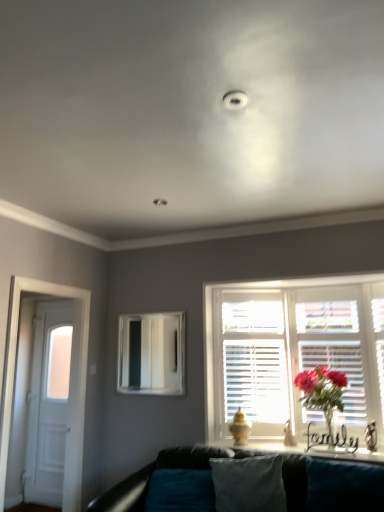
Describe the element at coordinates (292, 350) in the screenshot. Image resolution: width=384 pixels, height=512 pixels. I see `white wooden shutters at center` at that location.

Where is `teal fabric couch at lower center`? teal fabric couch at lower center is located at coordinates (325, 487).

This screenshot has width=384, height=512. What do you see at coordinates (14, 376) in the screenshot?
I see `white wooden door at left` at bounding box center [14, 376].

What do you see at coordinates (151, 354) in the screenshot? I see `metallic silver mirror at center` at bounding box center [151, 354].

Identify the location of white glossy vase at lower center. 316,451.

Can you confirm if teal fabric couch at lower center is wider than matte pink flowers at window?

Correct, the width of teal fabric couch at lower center exceeds that of matte pink flowers at window.

Which object is further away from the camera taking this photo, teal fabric couch at lower center or matte pink flowers at window?

Positioned behind is matte pink flowers at window.

Measure the distance between teal fabric couch at lower center and matte pink flowers at window.

teal fabric couch at lower center is 31.60 inches away from matte pink flowers at window.

Would you consider teal fabric couch at lower center to be distant from matte pink flowers at window?

No.

Is white glossy door at left outside of teal fabric couch at lower center?

white glossy door at left is positioned outside teal fabric couch at lower center.

This screenshot has height=512, width=384. I want to click on studio couch that is below the white glossy door at left (from the image's perspective), so click(x=325, y=487).

Can you confirm if white glossy door at left is positioned to the right of teal fabric couch at lower center?

No, white glossy door at left is not to the right of teal fabric couch at lower center.

From a real-world perspective, is teal fabric couch at lower center above or below white glossy vase at lower center?

teal fabric couch at lower center is below white glossy vase at lower center.

Is teal fabric couch at lower center facing towards white glossy vase at lower center?

No, teal fabric couch at lower center is not turned towards white glossy vase at lower center.

Does teal fabric couch at lower center have a greater height compared to white glossy vase at lower center?

Correct, teal fabric couch at lower center is much taller as white glossy vase at lower center.

Is teal fabric couch at lower center thinner than white glossy vase at lower center?

No.

Do you think metallic silver mirror at center is within teal fabric couch at lower center, or outside of it?

metallic silver mirror at center is outside teal fabric couch at lower center.

From the image's perspective, which one is positioned lower, metallic silver mirror at center or teal fabric couch at lower center?

From the image's view, teal fabric couch at lower center is below.

Between point (178, 320) and point (326, 505), which one is positioned behind?

The point (178, 320) is farther from the camera.

Based on the photo, which object is further away from the camera taking this photo, metallic silver mirror at center or teal fabric couch at lower center?

metallic silver mirror at center.

Which of these two, white wooden door at left or white glossy vase at lower center, is wider?

Wider between the two is white glossy vase at lower center.

From the image's perspective, which one is positioned higher, white wooden door at left or white glossy vase at lower center?

white wooden door at left.

Is white wooden door at left with white glossy vase at lower center?

No, white wooden door at left is not in contact with white glossy vase at lower center.

Which is behind, point (5, 479) or point (284, 445)?

Point (284, 445)

How different are the orientations of white glossy vase at lower center and white glossy door at left in degrees?

0.149 degrees.

Consider the image. Is white glossy vase at lower center oriented towards white glossy door at left?

No.

Considering the relative positions of white glossy vase at lower center and white glossy door at left in the image provided, is white glossy vase at lower center to the left or to the right of white glossy door at left?

Based on their positions, white glossy vase at lower center is located to the right of white glossy door at left.

Considering the relative sizes of white glossy vase at lower center and white glossy door at left in the image provided, is white glossy vase at lower center wider than white glossy door at left?

Yes, white glossy vase at lower center is wider than white glossy door at left.

Is white wooden door at left wider or thinner than velvety teal pillow at center?

In the image, white wooden door at left appears to be wider than velvety teal pillow at center.

How far apart are white wooden door at left and velvety teal pillow at center?

white wooden door at left is 1.60 meters from velvety teal pillow at center.

Locate an element on the screen. pillow on the right of white wooden door at left is located at coordinates (249, 484).

Identify the location of floral arrangement that is on the right side of teal fabric couch at lower center. (322, 392).

You are a GUI agent. You are given a task and a screenshot of the screen. Output one action in this format:
    pyautogui.click(x=<x>, y=<y>)
    Task: Click on the glass door that is behind the teal fabric couch at lower center
    
    Given the screenshot: What is the action you would take?
    pyautogui.click(x=53, y=411)

Looking at this image, when comparing their distances from matte pink flowers at window, does metallic silver mirror at center or white glossy vase at lower center seem further?

metallic silver mirror at center lies further to matte pink flowers at window than the other object.

Which object lies further to the anchor point matte pink flowers at window, white glossy vase at lower center or white glossy door at left?

Based on the image, white glossy door at left appears to be further to matte pink flowers at window.

Based on their spatial positions, is white glossy door at left or metallic silver mirror at center further from white glossy vase at lower center?

white glossy door at left lies further to white glossy vase at lower center than the other object.

Looking at the image, which one is located closer to white wooden shutters at center, velvety teal pillow at center or matte pink flowers at window?

Based on the image, matte pink flowers at window appears to be nearer to white wooden shutters at center.

Considering their positions, is white glossy door at left positioned further to teal fabric couch at lower center than white wooden shutters at center?

The object further to teal fabric couch at lower center is white glossy door at left.

From the image, which object appears to be farther from white glossy door at left, white wooden door at left or teal fabric couch at lower center?

Based on the image, teal fabric couch at lower center appears to be further to white glossy door at left.

Which object lies further to the anchor point teal fabric couch at lower center, white glossy door at left or velvety teal pillow at center?

The object further to teal fabric couch at lower center is white glossy door at left.

Which object lies further to the anchor point white glossy vase at lower center, white wooden door at left or metallic silver mirror at center?

white wooden door at left is positioned further to the anchor white glossy vase at lower center.

Identify the location of pillow between white glossy door at left and white wooden shutters at center in the horizontal direction. Image resolution: width=384 pixels, height=512 pixels. (249, 484).

Locate an element on the screen. This screenshot has height=512, width=384. bay window located between white wooden door at left and velvety teal pillow at center in the left-right direction is located at coordinates (151, 354).

The width and height of the screenshot is (384, 512). In order to click on window sill located between teal fabric couch at lower center and matte pink flowers at window in the depth direction in this screenshot , I will do coord(316,451).

Where is `pillow between teal fabric couch at lower center and white glossy vase at lower center from front to back`? pillow between teal fabric couch at lower center and white glossy vase at lower center from front to back is located at coordinates (249, 484).